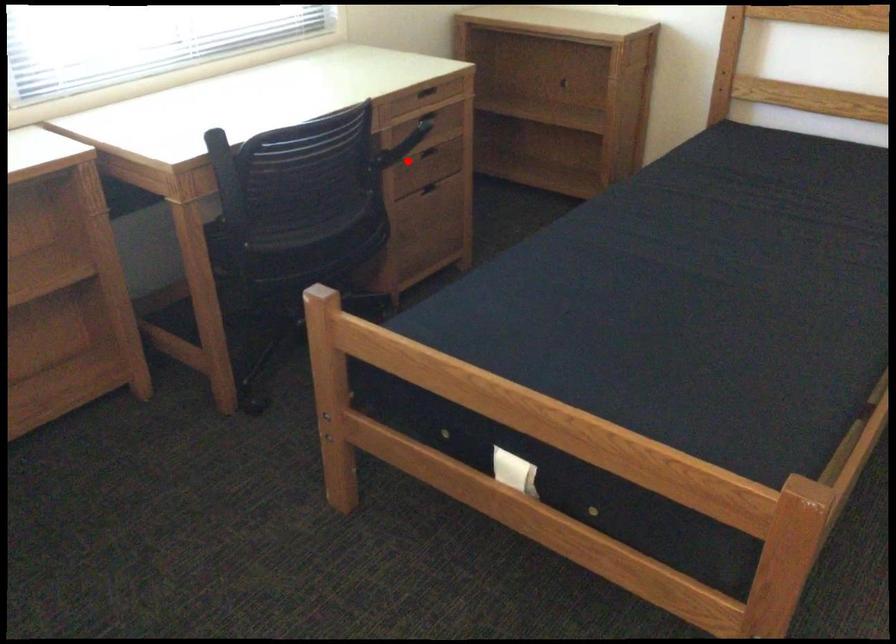
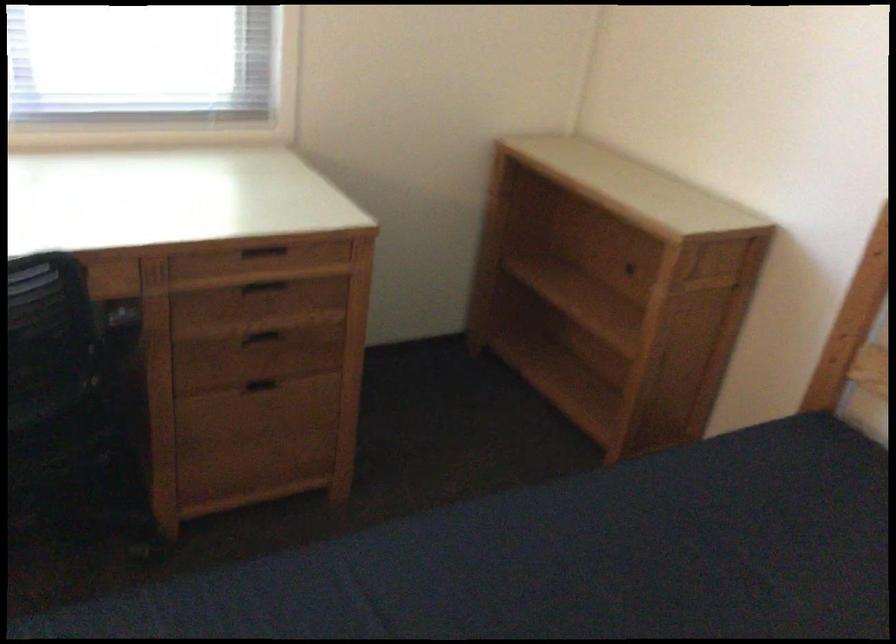
In the second image, find the point that corresponds to the highlighted location in the first image.

(264, 333)